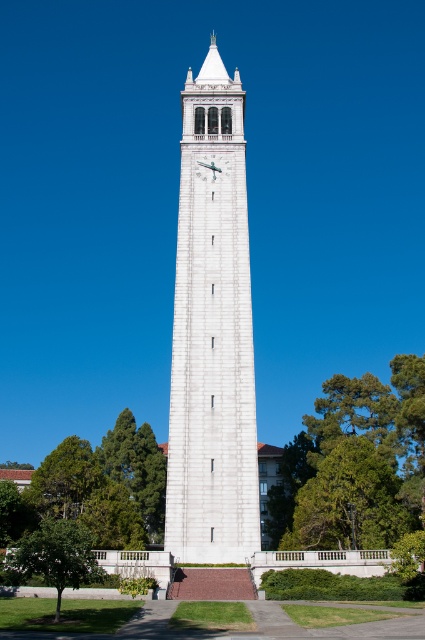
Is point (285, 506) less distant than point (210, 168)?

No, it is behind (210, 168).

Find the location of a particular element. This screenshot has height=640, width=425. green leafy tree at center is located at coordinates (356, 464).

In order to click on green leafy tree at center in this screenshot , I will do `click(356, 464)`.

Who is shorter, green leafy tree at center or green leafy tree at lower left?

green leafy tree at lower left is shorter.

Does green leafy tree at center have a larger size compared to green leafy tree at lower left?

Yes.

Who is more distant from viewer, (311, 440) or (82, 580)?

Point (311, 440)

Locate an element on the screen. The width and height of the screenshot is (425, 640). green leafy tree at center is located at coordinates (356, 464).

Is the position of white stone clock tower at center less distant than that of green leafy tree at center?

Yes, it is.

Does white stone clock tower at center have a greater height compared to green leafy tree at center?

Correct, white stone clock tower at center is much taller as green leafy tree at center.

Image resolution: width=425 pixels, height=640 pixels. I want to click on white stone clock tower at center, so click(x=212, y=333).

What are the coordinates of `white stone clock tower at center` in the screenshot? It's located at 212,333.